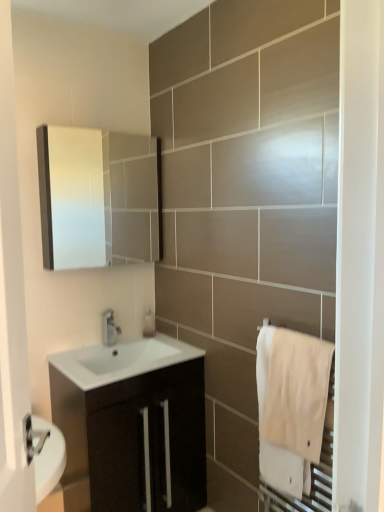
Question: From the image's perspective, is matte black cabinet at center on matte white medicine cabinet at upper left?

Choices:
 (A) yes
 (B) no

Answer: (B)

Question: Does matte black cabinet at center turn towards matte white medicine cabinet at upper left?

Choices:
 (A) no
 (B) yes

Answer: (A)

Question: Does matte black cabinet at center have a lesser height compared to matte white medicine cabinet at upper left?

Choices:
 (A) yes
 (B) no

Answer: (B)

Question: Is matte black cabinet at center facing away from matte white medicine cabinet at upper left?

Choices:
 (A) no
 (B) yes

Answer: (A)

Question: Is matte black cabinet at center outside of matte white medicine cabinet at upper left?

Choices:
 (A) no
 (B) yes

Answer: (B)

Question: Considering the relative sizes of matte black cabinet at center and matte white medicine cabinet at upper left in the image provided, is matte black cabinet at center thinner than matte white medicine cabinet at upper left?

Choices:
 (A) yes
 (B) no

Answer: (B)

Question: Considering the relative sizes of satin nickel faucet at center and matte white medicine cabinet at upper left in the image provided, is satin nickel faucet at center smaller than matte white medicine cabinet at upper left?

Choices:
 (A) yes
 (B) no

Answer: (A)

Question: Is satin nickel faucet at center with matte white medicine cabinet at upper left?

Choices:
 (A) yes
 (B) no

Answer: (B)

Question: From the image's perspective, does satin nickel faucet at center appear lower than matte white medicine cabinet at upper left?

Choices:
 (A) no
 (B) yes

Answer: (B)

Question: Is satin nickel faucet at center bigger than matte white medicine cabinet at upper left?

Choices:
 (A) no
 (B) yes

Answer: (A)

Question: Would you say satin nickel faucet at center is outside matte white medicine cabinet at upper left?

Choices:
 (A) no
 (B) yes

Answer: (B)

Question: Is satin nickel faucet at center turned away from matte white medicine cabinet at upper left?

Choices:
 (A) no
 (B) yes

Answer: (A)

Question: Is matte white medicine cabinet at upper left bigger than white glossy sink at center?

Choices:
 (A) yes
 (B) no

Answer: (A)